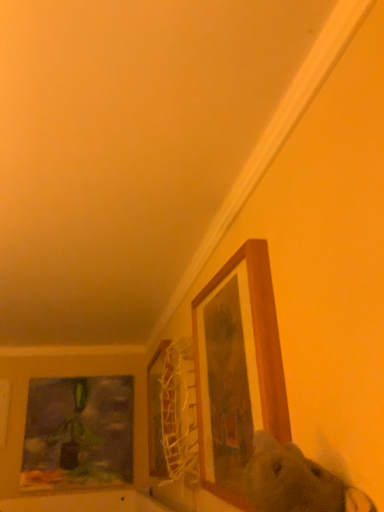
Question: Can you confirm if matte glass painting at left, which is the fourth picture frame from front to back, is shorter than wooden picture frame at lower left, the first picture frame when ordered from left to right?

Choices:
 (A) no
 (B) yes

Answer: (A)

Question: Is wooden picture frame at lower left, the first picture frame when ordered from left to right, a part of matte glass painting at left, which is counted as the 3th picture frame, starting from the right?

Choices:
 (A) yes
 (B) no

Answer: (B)

Question: Would you consider matte glass painting at left, which is the fourth picture frame from front to back, to be distant from wooden picture frame at lower left, the first picture frame when ordered from left to right?

Choices:
 (A) no
 (B) yes

Answer: (A)

Question: Is matte glass painting at left, the 2th picture frame when ordered from left to right, turned away from wooden picture frame at lower left, the 3th picture frame from the front?

Choices:
 (A) yes
 (B) no

Answer: (B)

Question: Can you confirm if matte glass painting at left, which is the fourth picture frame from front to back, is taller than wooden picture frame at lower left, which appears as the fourth picture frame when viewed from the right?

Choices:
 (A) no
 (B) yes

Answer: (B)

Question: Visually, is wooden frame at upper right, the 4th picture frame viewed from the back, positioned to the left or to the right of fluffy white dog at center?

Choices:
 (A) left
 (B) right

Answer: (A)

Question: Considering the positions of point (264, 309) and point (256, 500), is point (264, 309) closer or farther from the camera than point (256, 500)?

Choices:
 (A) farther
 (B) closer

Answer: (A)

Question: Is wooden frame at upper right, arranged as the 4th picture frame when viewed from the left, bigger or smaller than fluffy white dog at center?

Choices:
 (A) small
 (B) big

Answer: (B)

Question: Is wooden frame at upper right, arranged as the 4th picture frame when viewed from the left, in front of or behind fluffy white dog at center in the image?

Choices:
 (A) behind
 (B) front

Answer: (A)

Question: Based on their sizes in the image, would you say wooden picture frame at lower left, the 3th picture frame from the front, is bigger or smaller than matte glass painting at left, the first picture frame when ordered from back to front?

Choices:
 (A) big
 (B) small

Answer: (B)

Question: Does point (3, 418) appear closer or farther from the camera than point (39, 395)?

Choices:
 (A) closer
 (B) farther

Answer: (A)

Question: Is wooden picture frame at lower left, which appears as the fourth picture frame when viewed from the right, situated inside matte glass painting at left, the first picture frame when ordered from back to front, or outside?

Choices:
 (A) outside
 (B) inside

Answer: (A)

Question: From their relative heights in the image, would you say wooden picture frame at lower left, the 3th picture frame from the front, is taller or shorter than matte glass painting at left, which is the fourth picture frame from front to back?

Choices:
 (A) short
 (B) tall

Answer: (A)

Question: Does point (208, 449) appear closer or farther from the camera than point (39, 480)?

Choices:
 (A) closer
 (B) farther

Answer: (A)

Question: From the image's perspective, is wooden frame at upper right, arranged as the 4th picture frame when viewed from the left, above or below matte glass painting at left, the 2th picture frame when ordered from left to right?

Choices:
 (A) below
 (B) above

Answer: (B)